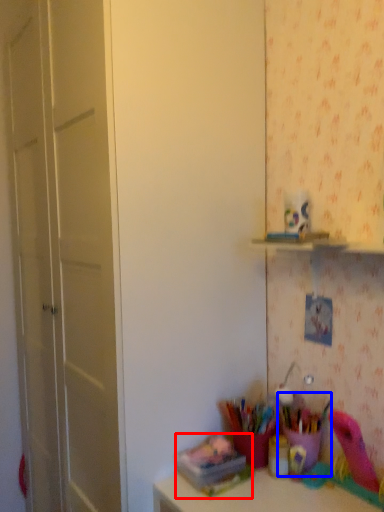
Question: Which point is further to the camera, stationery (highlighted by a red box) or stationery (highlighted by a blue box)?

Choices:
 (A) stationery
 (B) stationery

Answer: (B)